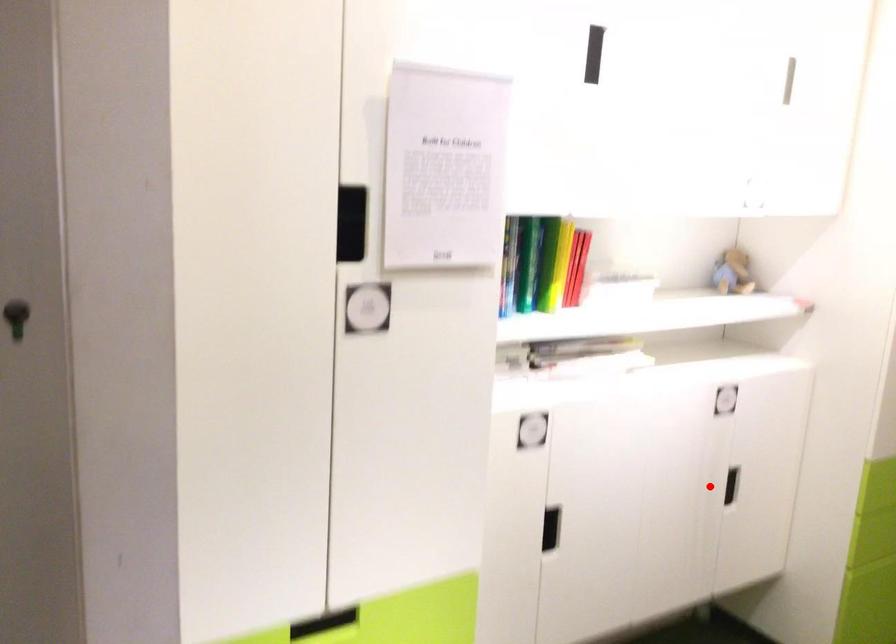
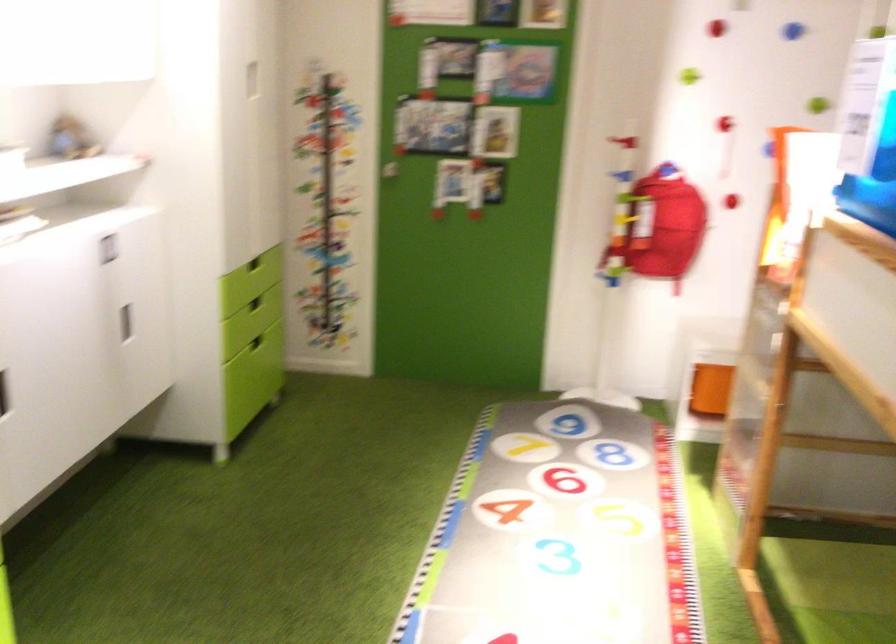
Question: I am providing you with two images of the same scene from different viewpoints. Given a red point in image1, look at the same physical point in image2. Is it:

Choices:
 (A) Closer to the viewpoint
 (B) Farther from the viewpoint

Answer: (B)